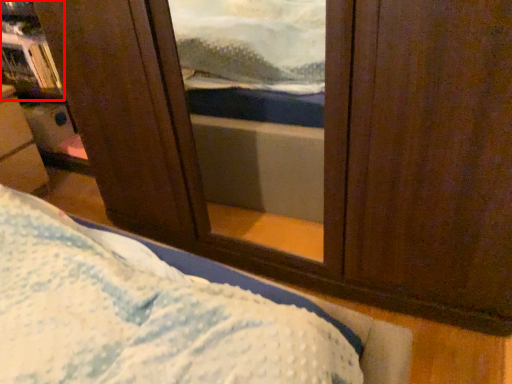
Question: From the image's perspective, what is the correct spatial positioning of bookshelf (annotated by the red box) in reference to furniture?

Choices:
 (A) below
 (B) above

Answer: (B)